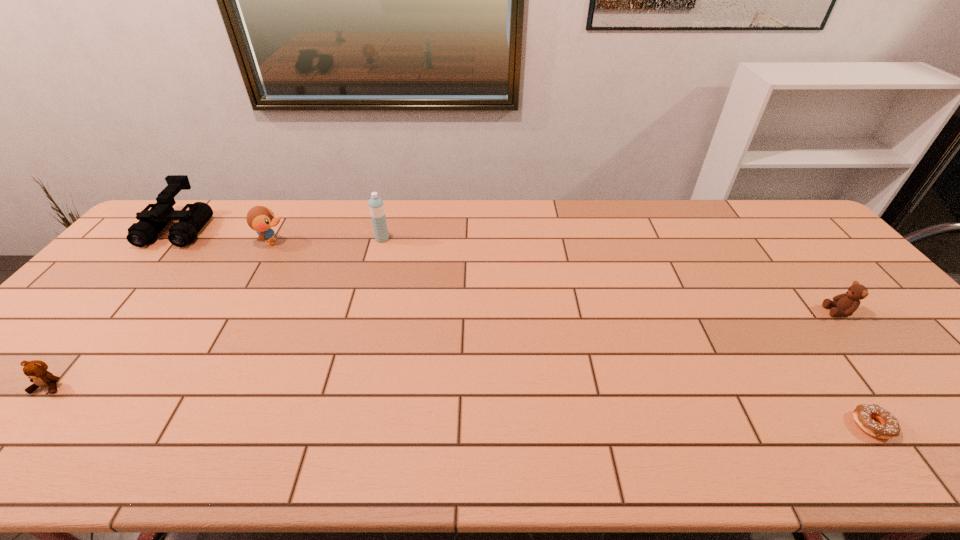
Locate an element on the screen. The height and width of the screenshot is (540, 960). object that is at the near edge is located at coordinates (889, 427).

This screenshot has width=960, height=540. Identify the location of binoculars present at the left edge. click(x=151, y=222).

The height and width of the screenshot is (540, 960). Identify the location of teddy bear that is at the left edge. (36, 370).

Locate an element on the screen. object situated at the right edge is located at coordinates (845, 304).

Find the location of a particular element. The width and height of the screenshot is (960, 540). object located in the far left corner section of the desktop is located at coordinates (151, 222).

This screenshot has width=960, height=540. I want to click on free space at the far edge of the desktop, so point(434,225).

Find the location of a particular element. The height and width of the screenshot is (540, 960). blank area at the near edge is located at coordinates (512, 427).

In the image, there is a desktop. Identify the location of vacant space at the right edge. (791, 254).

Locate an element on the screen. This screenshot has height=540, width=960. free space at the far left corner of the desktop is located at coordinates (190, 200).

Locate an element on the screen. This screenshot has height=540, width=960. blank region between the nearer teddy bear and the shortest object is located at coordinates (461, 406).